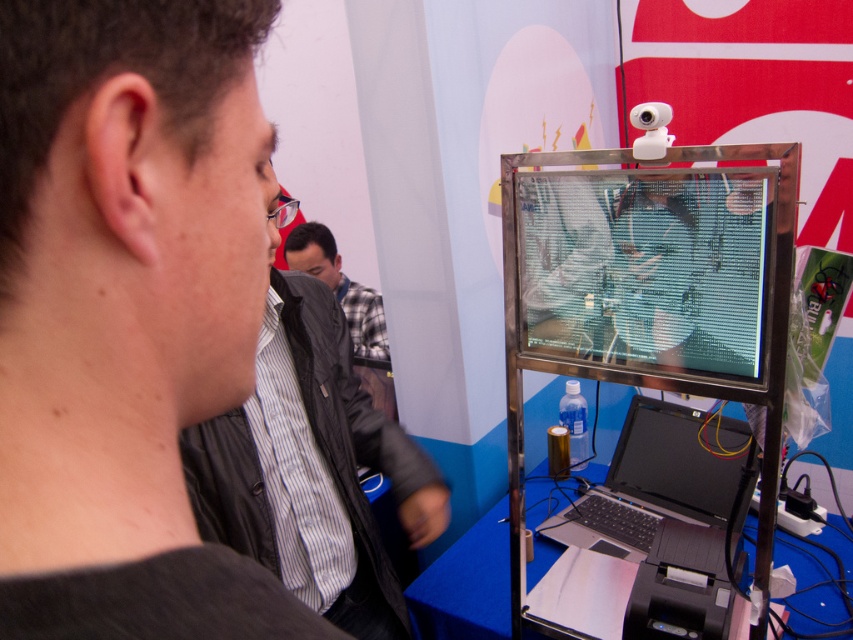
Does point (213, 432) come farther from viewer compared to point (376, 344)?

That is False.

Locate an element on the screen. dark gray jacket at center is located at coordinates (312, 468).

Where is `dark gray jacket at center`? The image size is (853, 640). dark gray jacket at center is located at coordinates (312, 468).

Does black matte jacket at upper left have a lesser width compared to plaid fabric shirt at center?

Yes.

Does black matte jacket at upper left have a smaller size compared to plaid fabric shirt at center?

Yes.

Is point (229, 323) more distant than point (357, 317)?

No.

What are the coordinates of `black matte jacket at upper left` in the screenshot? It's located at (126, 312).

Can you confirm if transparent plastic screen at center is wider than black matte laptop at center?

No.

Between point (729, 284) and point (718, 515), which one is positioned behind?

Positioned behind is point (718, 515).

Between point (619, 362) and point (624, 476), which one is positioned behind?

The point (624, 476) is behind.

This screenshot has width=853, height=640. Identify the location of transparent plastic screen at center. (645, 268).